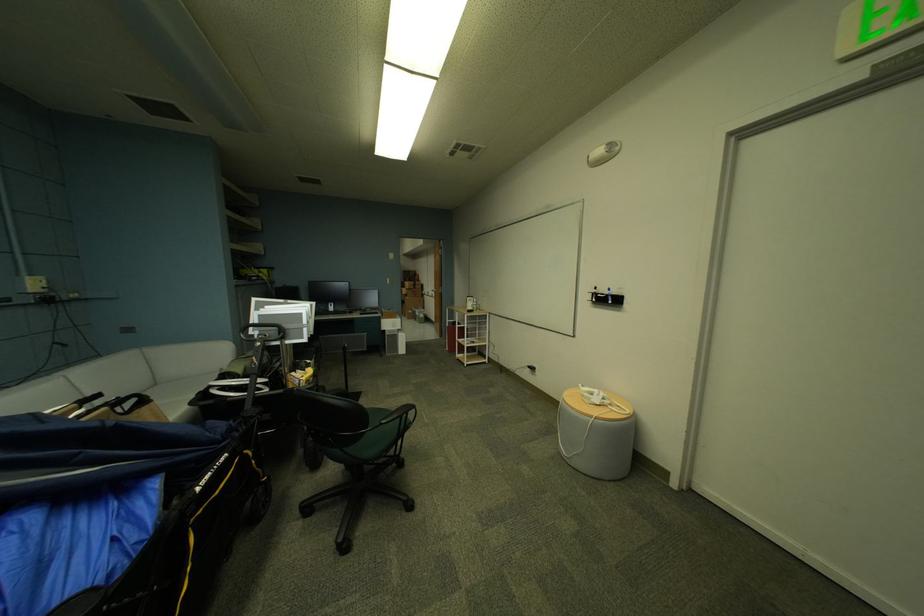
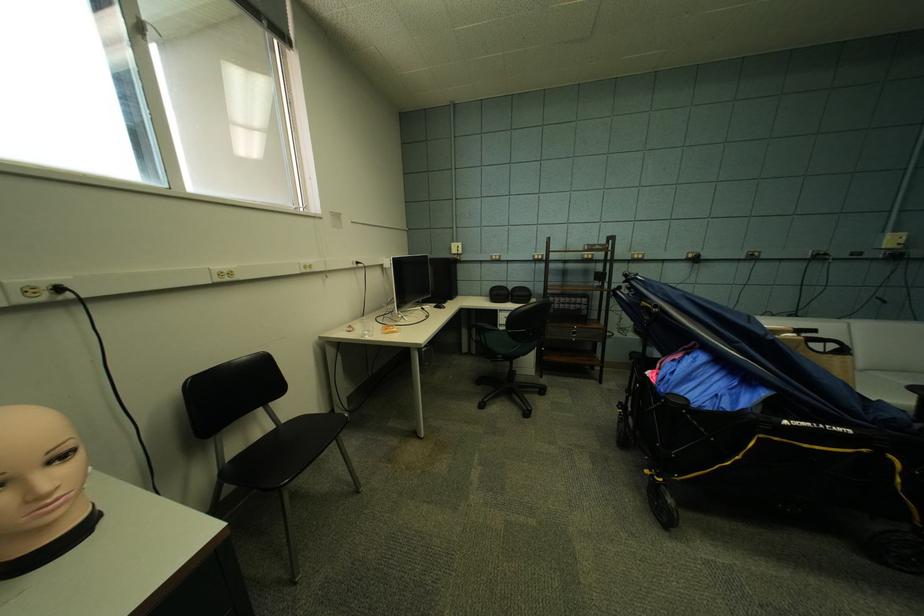
Find the pixel in the second image that matches (x=92, y=403) in the first image.

(808, 331)